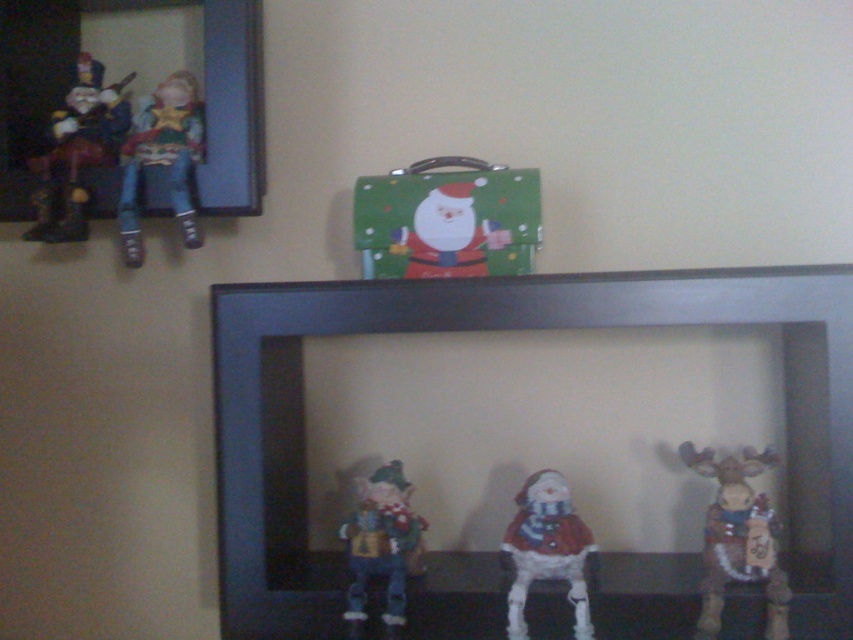
Question: Is fuzzy brown moose at lower right smaller than white matte santa at center?

Choices:
 (A) yes
 (B) no

Answer: (B)

Question: Among these points, which one is farthest from the camera?

Choices:
 (A) (474, 257)
 (B) (132, 132)

Answer: (B)

Question: Which point appears farthest from the camera in this image?

Choices:
 (A) (364, 586)
 (B) (709, 548)

Answer: (A)

Question: Can you confirm if fuzzy brown moose at lower right is positioned above matte plastic pig at center?

Choices:
 (A) no
 (B) yes

Answer: (B)

Question: Where is wooden frame at upper left located in relation to green matte suitcase at upper center in the image?

Choices:
 (A) above
 (B) below

Answer: (A)

Question: Which point is closer to the camera?

Choices:
 (A) (125, 161)
 (B) (235, 180)
 (C) (344, 534)
 (D) (54, 204)

Answer: (C)